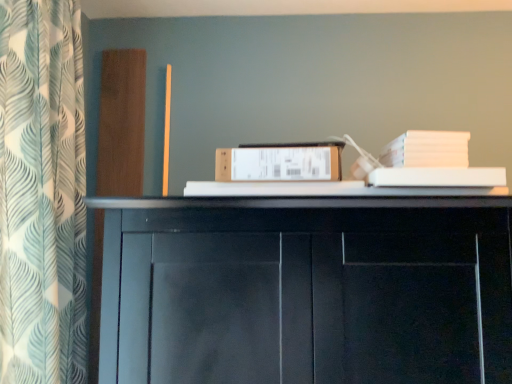
At what (x,y) coordinates should I click in order to perform the action: click on white leaf-patterned curtain at left. Please return your answer as a coordinate pair (x, y). The height and width of the screenshot is (384, 512). Looking at the image, I should click on 42,193.

Describe the element at coordinates (42, 193) in the screenshot. I see `white leaf-patterned curtain at left` at that location.

The image size is (512, 384). Identify the location of white cardboard box at center. (280, 162).

Measure the distance between white cardboard box at center and camera.

The depth of white cardboard box at center is 36.38 inches.

What is the approximate height of white cardboard box at center?

white cardboard box at center is 4.24 inches in height.

This screenshot has height=384, width=512. What do you see at coordinates (280, 162) in the screenshot? I see `white cardboard box at center` at bounding box center [280, 162].

Where is `white leaf-patterned curtain at left`? Image resolution: width=512 pixels, height=384 pixels. white leaf-patterned curtain at left is located at coordinates (42, 193).

Can you confirm if white cardboard box at center is positioned to the left of white leaf-patterned curtain at left?

In fact, white cardboard box at center is to the right of white leaf-patterned curtain at left.

Is white cardboard box at center in front of or behind white leaf-patterned curtain at left in the image?

white cardboard box at center is behind white leaf-patterned curtain at left.

Is point (339, 176) closer or farther from the camera than point (8, 182)?

Point (339, 176) is positioned farther from the camera compared to point (8, 182).

From the image's perspective, is white cardboard box at center above or below white leaf-patterned curtain at left?

Based on their image positions, white cardboard box at center is located beneath white leaf-patterned curtain at left.

From a real-world perspective, is white cardboard box at center positioned above or below white leaf-patterned curtain at left?

Clearly, from a real-world perspective, white cardboard box at center is below white leaf-patterned curtain at left.

Based on the photo, in terms of width, does white cardboard box at center look wider or thinner when compared to white leaf-patterned curtain at left?

white cardboard box at center is thinner than white leaf-patterned curtain at left.

Consider the image. Who is shorter, white cardboard box at center or white leaf-patterned curtain at left?

Standing shorter between the two is white cardboard box at center.

Does white cardboard box at center have a larger size compared to white leaf-patterned curtain at left?

Incorrect, white cardboard box at center is not larger than white leaf-patterned curtain at left.

Can white leaf-patterned curtain at left be found inside white cardboard box at center?

No, white leaf-patterned curtain at left is not inside white cardboard box at center.

Is white cardboard box at center not near white leaf-patterned curtain at left?

Actually, white cardboard box at center and white leaf-patterned curtain at left are a little close together.

Could you tell me if white cardboard box at center is facing white leaf-patterned curtain at left?

No, white cardboard box at center does not turn towards white leaf-patterned curtain at left.

Can you tell me how much white cardboard box at center and white leaf-patterned curtain at left differ in facing direction?

The facing directions of white cardboard box at center and white leaf-patterned curtain at left are 92.7 degrees apart.

This screenshot has width=512, height=384. In order to click on paperback book below the white leaf-patterned curtain at left (from the image's perspective) in this screenshot , I will do pos(280,162).

Considering the relative positions of white leaf-patterned curtain at left and white cardboard box at center in the image provided, is white leaf-patterned curtain at left to the left or to the right of white cardboard box at center?

From the image, it's evident that white leaf-patterned curtain at left is to the left of white cardboard box at center.

Relative to white cardboard box at center, is white leaf-patterned curtain at left in front or behind?

Clearly, white leaf-patterned curtain at left is in front of white cardboard box at center.

Is point (9, 104) positioned before point (238, 162)?

Yes, it is.

From the image's perspective, is white leaf-patterned curtain at left located above or below white cardboard box at center?

Clearly, from the image's perspective, white leaf-patterned curtain at left is above white cardboard box at center.

From a real-world perspective, which object rests below the other?

From a 3D spatial view, white cardboard box at center is below.

Is white leaf-patterned curtain at left thinner than white cardboard box at center?

Incorrect, the width of white leaf-patterned curtain at left is not less than that of white cardboard box at center.

Does white leaf-patterned curtain at left have a lesser height compared to white cardboard box at center?

No, white leaf-patterned curtain at left is not shorter than white cardboard box at center.

Does white leaf-patterned curtain at left have a smaller size compared to white cardboard box at center?

No.

Is white leaf-patterned curtain at left positioned beyond the bounds of white cardboard box at center?

Yes, white leaf-patterned curtain at left is outside of white cardboard box at center.

Are white leaf-patterned curtain at left and white cardboard box at center located far from each other?

Actually, white leaf-patterned curtain at left and white cardboard box at center are a little close together.

Is white cardboard box at center at the back of white leaf-patterned curtain at left?

Yes.

How many degrees apart are the facing directions of white leaf-patterned curtain at left and white cardboard box at center?

The facing directions of white leaf-patterned curtain at left and white cardboard box at center are 92.7 degrees apart.

Find the location of `curtain in front of the white cardboard box at center`. curtain in front of the white cardboard box at center is located at coordinates (42, 193).

Identify the location of paperback book that is on the right side of white leaf-patterned curtain at left. (280, 162).

Find the location of `curtain located on the left of white cardboard box at center`. curtain located on the left of white cardboard box at center is located at coordinates (42, 193).